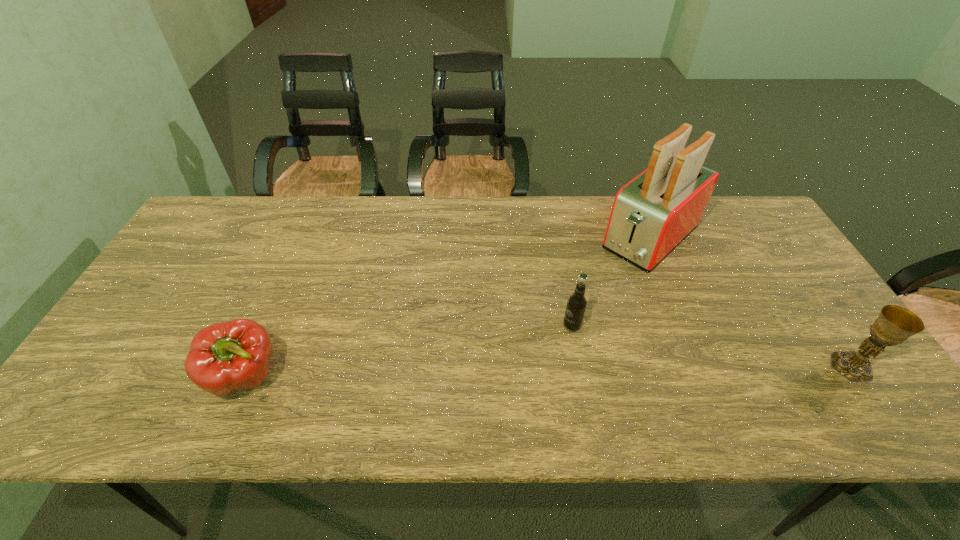
Where is `vacant space on the desktop that is between the leftmost object and the rightmost object and is positioned on the front-facing side of the tallest object`? Image resolution: width=960 pixels, height=540 pixels. vacant space on the desktop that is between the leftmost object and the rightmost object and is positioned on the front-facing side of the tallest object is located at coordinates coord(499,373).

Find the location of a particular element. free space on the desktop that is between the pepper and the chalice and is positioned on the label of the root beer is located at coordinates (517, 373).